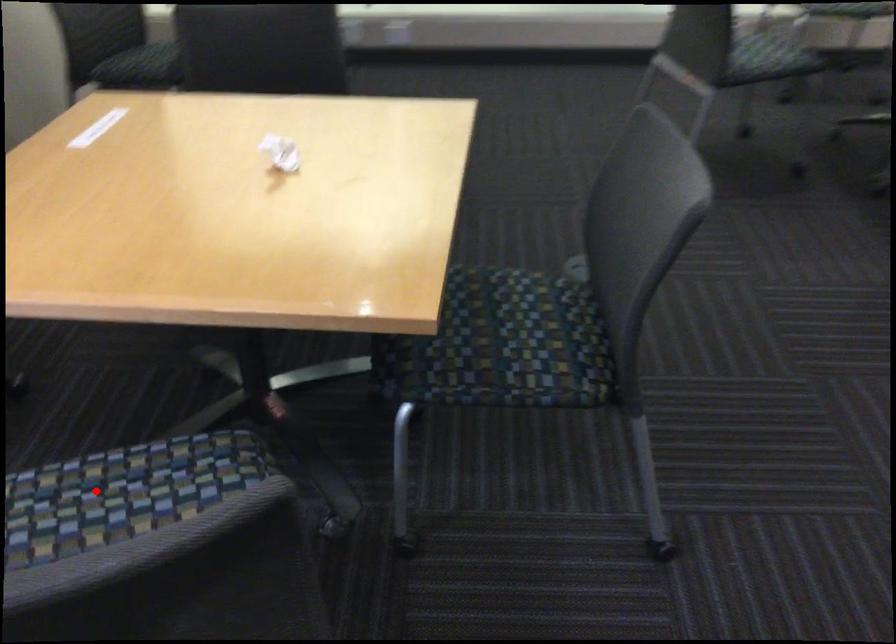
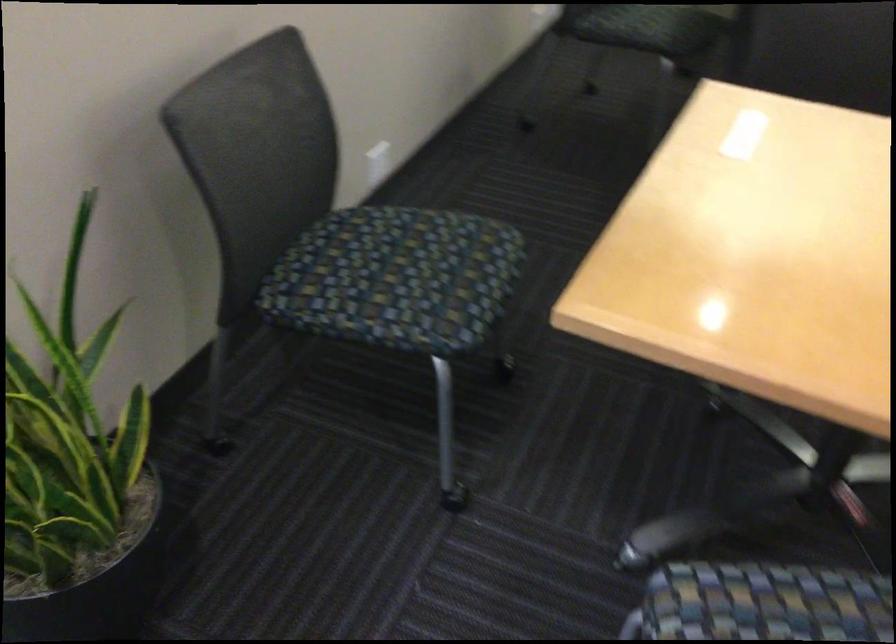
Locate, in the second image, the point that corresponds to the highlighted location in the first image.

(765, 603)